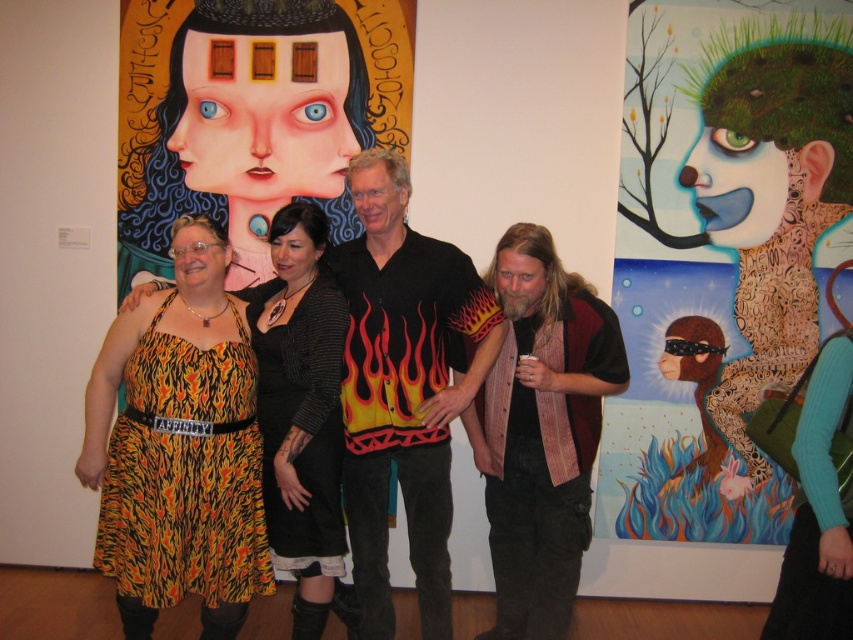
Question: Estimate the real-world distances between objects in this image. Which object is closer to the flame-patterned dress at center?

Choices:
 (A) flame-patterned jersey at center
 (B) flannel vest at center

Answer: (A)

Question: Is the position of flame-patterned jersey at center more distant than that of flame-patterned dress at center?

Choices:
 (A) no
 (B) yes

Answer: (B)

Question: Can you confirm if flame-patterned jersey at center is thinner than flame-patterned dress at center?

Choices:
 (A) no
 (B) yes

Answer: (A)

Question: Which object is the farthest from the flame-patterned jersey at center?

Choices:
 (A) flannel vest at center
 (B) flame-patterned dress at center

Answer: (A)

Question: Does flame-patterned jersey at center appear under flannel vest at center?

Choices:
 (A) yes
 (B) no

Answer: (B)

Question: Which point is farther to the camera?

Choices:
 (A) flame-patterned jersey at center
 (B) flame-patterned dress at center

Answer: (A)